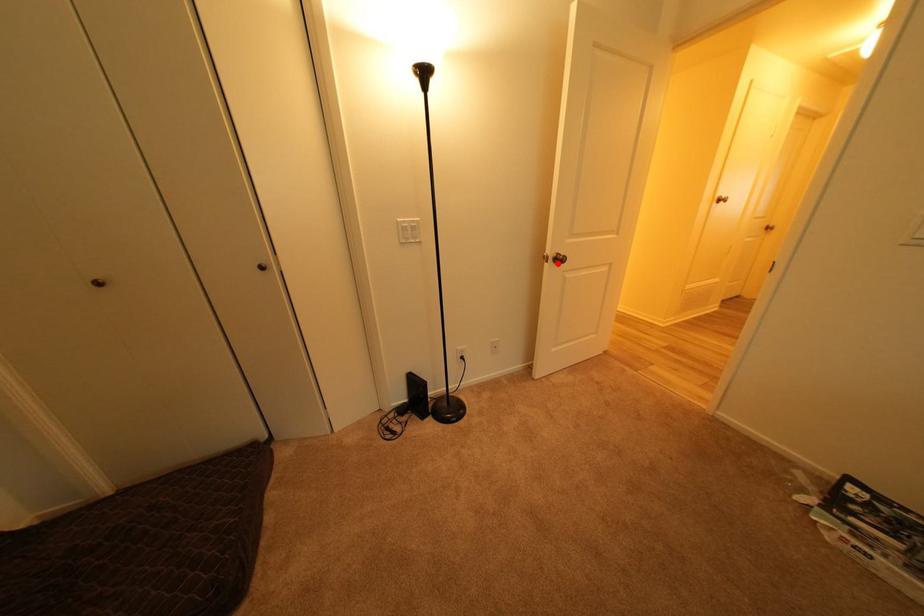
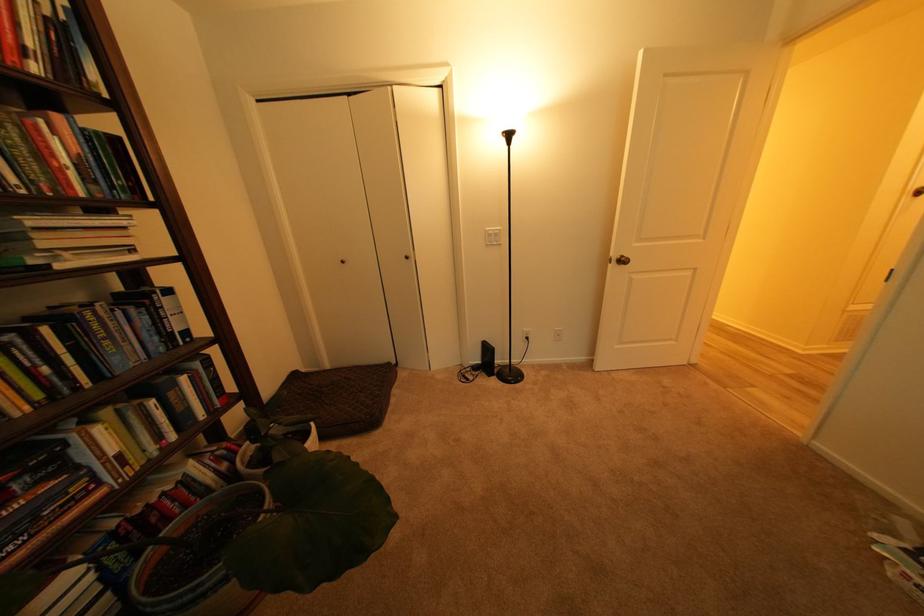
Find the pixel in the second image that matches the highlighted location in the first image.

(621, 265)